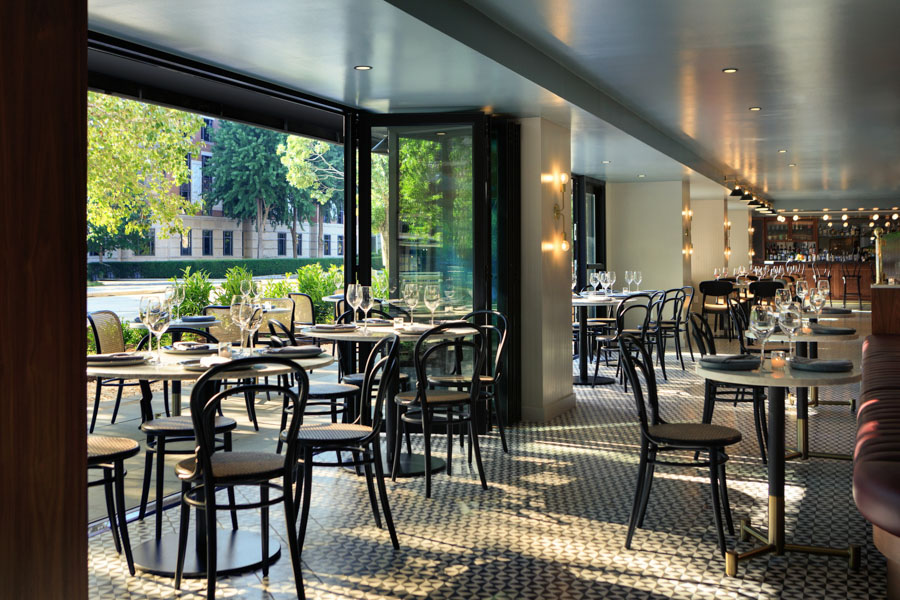
Where is `glass`? Image resolution: width=900 pixels, height=600 pixels. glass is located at coordinates (239, 301), (164, 318), (362, 293).